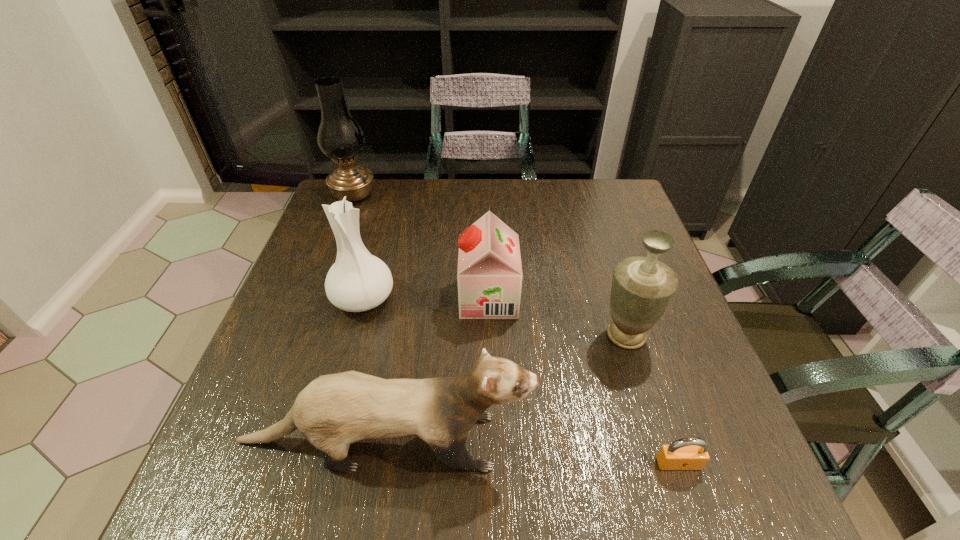
This screenshot has width=960, height=540. What are the coordinates of `the farthest object` in the screenshot? It's located at (340, 137).

This screenshot has width=960, height=540. What are the coordinates of `the tallest object` in the screenshot? It's located at (340, 137).

Where is `urn`? The width and height of the screenshot is (960, 540). urn is located at coordinates (642, 287).

This screenshot has height=540, width=960. I want to click on vase, so click(x=358, y=281).

Image resolution: width=960 pixels, height=540 pixels. What are the coordinates of `ferret` in the screenshot? It's located at (334, 410).

You are a GUI agent. You are given a task and a screenshot of the screen. Output one action in this format:
    pyautogui.click(x=<x>, y=<y>)
    Task: Click on the soya milk
    The height and width of the screenshot is (540, 960).
    Given the screenshot: What is the action you would take?
    pyautogui.click(x=489, y=275)

This screenshot has height=540, width=960. What are the coordinates of `padlock` in the screenshot? It's located at (691, 453).

Identify the location of free region located 0.280m on the front of the farthest object. The height and width of the screenshot is (540, 960). (324, 272).

The height and width of the screenshot is (540, 960). What are the coordinates of `vacant space located 0.090m on the back of the urn` in the screenshot? It's located at (612, 286).

At what (x,y) coordinates should I click in order to perform the action: click on vacant region located on the right of the vase. Please return your answer as a coordinate pair (x, y). The image size is (960, 540). Looking at the image, I should click on (534, 298).